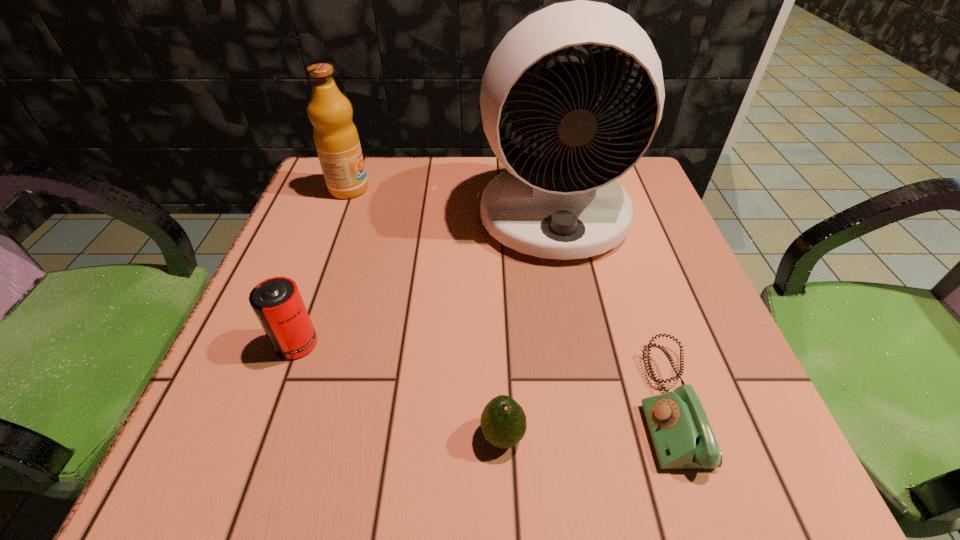
Where is `fan`? The height and width of the screenshot is (540, 960). fan is located at coordinates (565, 206).

Image resolution: width=960 pixels, height=540 pixels. I want to click on the second tallest object, so click(336, 139).

Image resolution: width=960 pixels, height=540 pixels. Identify the location of the third shortest object. (277, 303).

The width and height of the screenshot is (960, 540). I want to click on avocado, so click(503, 422).

Where is `telephone`? telephone is located at coordinates (x=681, y=434).

Identify the location of vacant space located on the grille of the fan. The width and height of the screenshot is (960, 540). (569, 299).

In order to click on vacant point located 0.120m on the front label of the fruit juice in this screenshot , I will do `click(420, 189)`.

Where is `vacant space located on the right of the third tallest object`? vacant space located on the right of the third tallest object is located at coordinates pyautogui.click(x=405, y=343).

Where is `vacant area situated on the left of the second shortest object`? The height and width of the screenshot is (540, 960). vacant area situated on the left of the second shortest object is located at coordinates (325, 436).

Where is `free space located 0.340m on the dial of the telephone`? free space located 0.340m on the dial of the telephone is located at coordinates (401, 403).